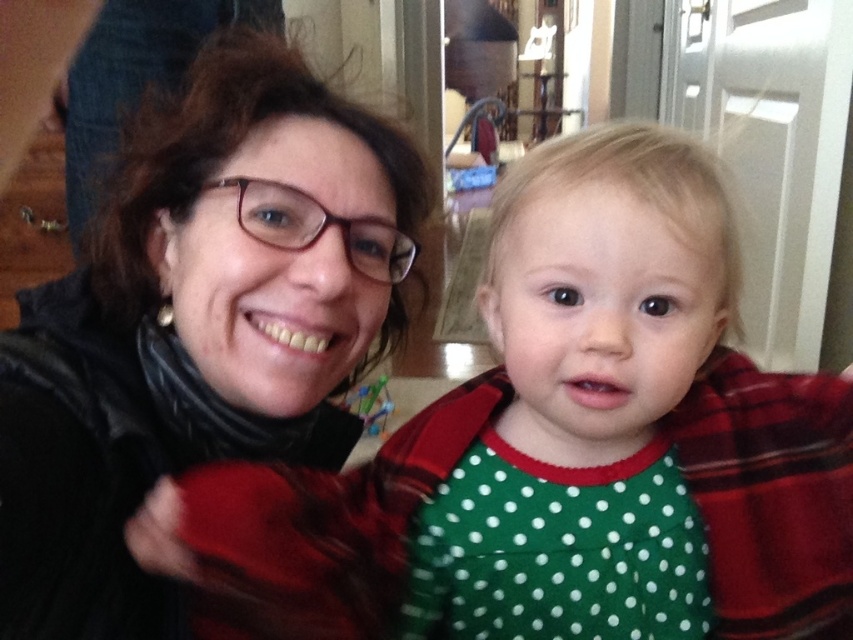
Is matte black scarf at left wider than matte black glasses at upper center?

No, matte black scarf at left is not wider than matte black glasses at upper center.

Who is positioned more to the right, matte black scarf at left or matte black glasses at upper center?

matte black scarf at left

At what (x,y) coordinates should I click in order to perform the action: click on matte black scarf at left. Please return your answer as a coordinate pair (x, y). The height and width of the screenshot is (640, 853). Looking at the image, I should click on (196, 326).

Does green dotted fabric at center have a greater height compared to matte black glasses at upper center?

No, green dotted fabric at center is not taller than matte black glasses at upper center.

Does green dotted fabric at center come behind matte black glasses at upper center?

No.

Is point (700, 320) positioned after point (144, 35)?

No, (700, 320) is in front of (144, 35).

Where is `green dotted fabric at center`? green dotted fabric at center is located at coordinates (556, 451).

Is green dotted fabric at center behind matte black scarf at left?

Yes, green dotted fabric at center is behind matte black scarf at left.

Who is more forward, (772, 458) or (183, 394)?

Point (772, 458) is more forward.

This screenshot has height=640, width=853. I want to click on green dotted fabric at center, so 556,451.